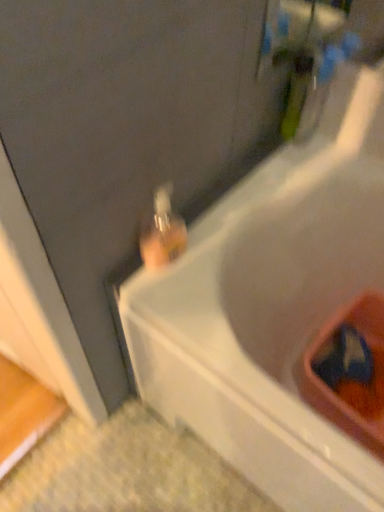
Describe the element at coordinates (272, 307) in the screenshot. This screenshot has height=512, width=384. I see `white plastic bathtub at upper right` at that location.

You are a GUI agent. You are given a task and a screenshot of the screen. Output one action in this format:
    pyautogui.click(x=<x>, y=<y>)
    Task: Click on the white plastic bathtub at upper right
    The image size is (384, 512).
    Given the screenshot: What is the action you would take?
    pyautogui.click(x=272, y=307)

Locate an element on the screen. Image resolution: width=384 pixels, height=512 pixels. translucent glass bottle at upper center is located at coordinates (162, 232).

Describe the element at coordinates (162, 232) in the screenshot. I see `translucent glass bottle at upper center` at that location.

Locate an element on the screen. white plastic bathtub at upper right is located at coordinates (272, 307).

Which is more to the left, translucent glass bottle at upper center or white plastic bathtub at upper right?

From the viewer's perspective, translucent glass bottle at upper center appears more on the left side.

Is translucent glass bottle at upper center further to camera compared to white plastic bathtub at upper right?

Yes, the depth of translucent glass bottle at upper center is greater than that of white plastic bathtub at upper right.

Which point is more distant from viewer, (164, 184) or (369, 502)?

The point (164, 184) is farther from the camera.

From the image's perspective, which is below, translucent glass bottle at upper center or white plastic bathtub at upper right?

From the image's view, white plastic bathtub at upper right is below.

From a real-world perspective, does translucent glass bottle at upper center stand above white plastic bathtub at upper right?

Yes, from a real-world perspective, translucent glass bottle at upper center is above white plastic bathtub at upper right.

Which object is wider, translucent glass bottle at upper center or white plastic bathtub at upper right?

white plastic bathtub at upper right is wider.

Considering the relative sizes of translucent glass bottle at upper center and white plastic bathtub at upper right in the image provided, is translucent glass bottle at upper center shorter than white plastic bathtub at upper right?

Indeed, translucent glass bottle at upper center has a lesser height compared to white plastic bathtub at upper right.

Considering the sizes of objects translucent glass bottle at upper center and white plastic bathtub at upper right in the image provided, who is smaller, translucent glass bottle at upper center or white plastic bathtub at upper right?

translucent glass bottle at upper center is smaller.

Would you say translucent glass bottle at upper center is inside or outside white plastic bathtub at upper right?

translucent glass bottle at upper center is located beyond the bounds of white plastic bathtub at upper right.

Is there a large distance between translucent glass bottle at upper center and white plastic bathtub at upper right?

Actually, translucent glass bottle at upper center and white plastic bathtub at upper right are a little close together.

Is translucent glass bottle at upper center turned away from white plastic bathtub at upper right?

That's not correct — translucent glass bottle at upper center is not looking away from white plastic bathtub at upper right.

Locate an element on the screen. bottle above the white plastic bathtub at upper right (from a real-world perspective) is located at coordinates tap(162, 232).

Considering the relative positions of white plastic bathtub at upper right and translucent glass bottle at upper center in the image provided, is white plastic bathtub at upper right to the left of translucent glass bottle at upper center from the viewer's perspective?

In fact, white plastic bathtub at upper right is to the right of translucent glass bottle at upper center.

Considering their positions, is white plastic bathtub at upper right located in front of or behind translucent glass bottle at upper center?

In the image, white plastic bathtub at upper right appears in front of translucent glass bottle at upper center.

Does point (355, 449) lie in front of point (141, 254)?

That is True.

From the image's perspective, is white plastic bathtub at upper right positioned above or below translucent glass bottle at upper center?

From the image's perspective, white plastic bathtub at upper right appears below translucent glass bottle at upper center.

From a real-world perspective, which is physically below, white plastic bathtub at upper right or translucent glass bottle at upper center?

white plastic bathtub at upper right, from a real-world perspective.

Considering the sizes of white plastic bathtub at upper right and translucent glass bottle at upper center in the image, is white plastic bathtub at upper right wider or thinner than translucent glass bottle at upper center?

In the image, white plastic bathtub at upper right appears to be wider than translucent glass bottle at upper center.

Can you confirm if white plastic bathtub at upper right is shorter than translucent glass bottle at upper center?

Incorrect, the height of white plastic bathtub at upper right does not fall short of that of translucent glass bottle at upper center.

In terms of size, does white plastic bathtub at upper right appear bigger or smaller than translucent glass bottle at upper center?

Considering their sizes, white plastic bathtub at upper right takes up more space than translucent glass bottle at upper center.

Is white plastic bathtub at upper right spatially inside translucent glass bottle at upper center, or outside of it?

white plastic bathtub at upper right is spatially situated outside translucent glass bottle at upper center.

Is white plastic bathtub at upper right in contact with translucent glass bottle at upper center?

No, white plastic bathtub at upper right is not in contact with translucent glass bottle at upper center.

Is white plastic bathtub at upper right aimed at translucent glass bottle at upper center?

No, white plastic bathtub at upper right is not facing towards translucent glass bottle at upper center.

The height and width of the screenshot is (512, 384). Identify the location of bottle behind the white plastic bathtub at upper right. (162, 232).

I want to click on bottle on the left of the white plastic bathtub at upper right, so click(162, 232).

Where is `bottle located above the white plastic bathtub at upper right (from a real-world perspective)`? bottle located above the white plastic bathtub at upper right (from a real-world perspective) is located at coordinates (162, 232).